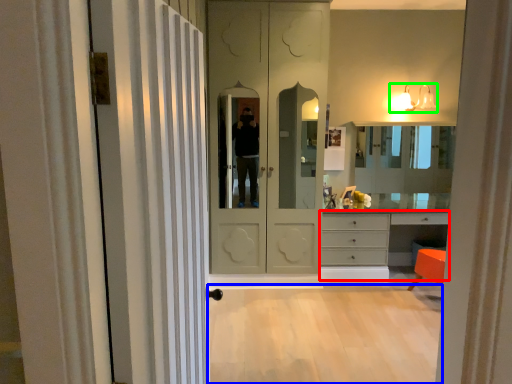
Question: Which object is positioned closest to chest of drawers (highlighted by a red box)? Select from plain (highlighted by a blue box) and light fixture (highlighted by a green box).

Choices:
 (A) plain
 (B) light fixture

Answer: (A)